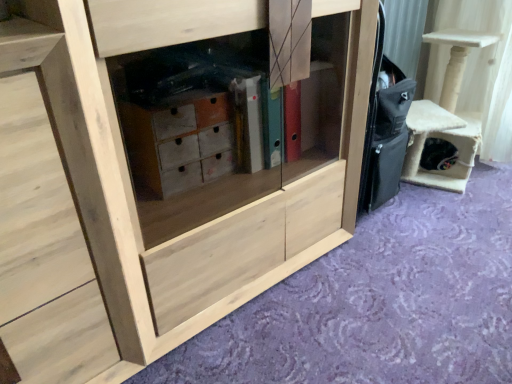
Question: Do you think natural wood cabinet at center is within natural wood cabinet at lower left, or outside of it?

Choices:
 (A) inside
 (B) outside

Answer: (B)

Question: From the image's perspective, relative to natural wood cabinet at lower left, is natural wood cabinet at center above or below?

Choices:
 (A) above
 (B) below

Answer: (A)

Question: Which is farther from the beige felt cat house at right?

Choices:
 (A) natural wood cabinet at lower left
 (B) natural wood cabinet at center

Answer: (A)

Question: Which object is positioned farthest from the natural wood cabinet at lower left?

Choices:
 (A) natural wood cabinet at center
 (B) beige felt cat house at right

Answer: (B)